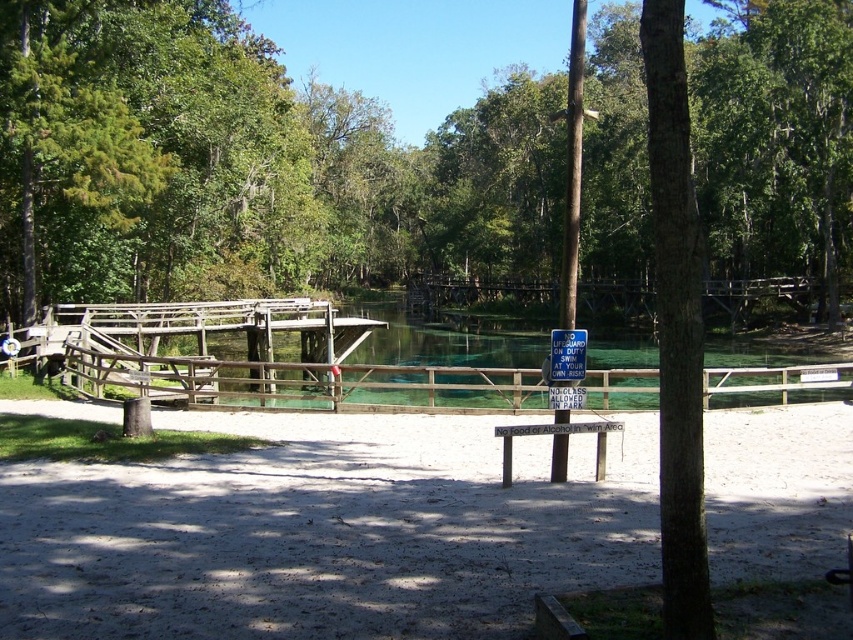
You are standing on the white sandy ground at center and want to reach the water behind the brown wooden fence at center. Can you see the water from where you are standing?

The white sandy ground at center is not as tall as brown wooden fence at center, so the fence blocks your view of the water behind it. You cannot see the water from where you are standing.

You are standing on the beach and want to take a photo of both the green leafy tree at center and the brown wooden fence at center. Which object should you position closer to the camera to include both in your frame?

To include both the green leafy tree at center and the brown wooden fence at center in your frame, you should position the green leafy tree at center closer to the camera since it is in front of the brown wooden fence at center.

What are the coordinates of the green leafy tree at center?

The green leafy tree at center is located at coordinates point [242,164].